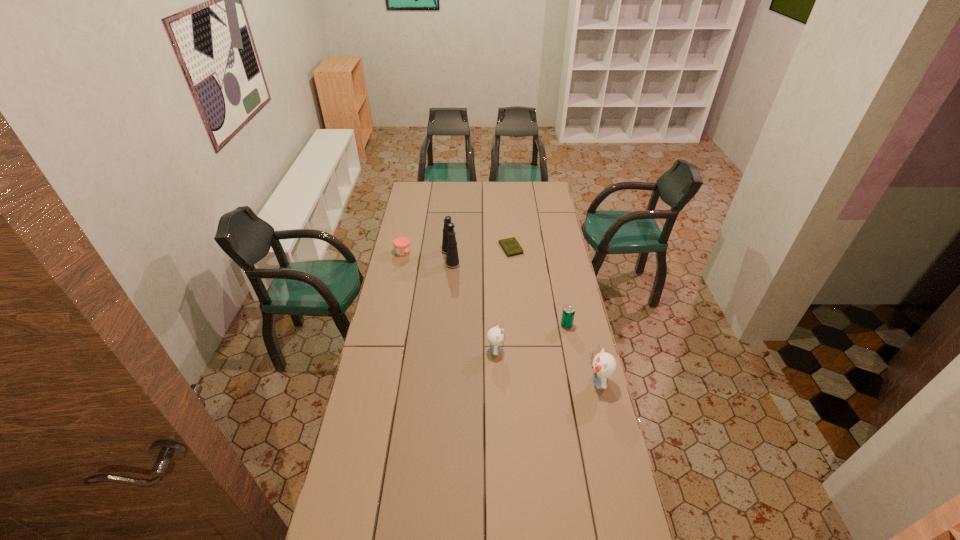
Locate an element on the screen. This screenshot has height=540, width=960. the left kitten is located at coordinates (495, 336).

The image size is (960, 540). Identify the location of the shorter kitten. (495, 336).

This screenshot has width=960, height=540. I want to click on the fifth shortest object, so click(604, 365).

You are a GUI agent. You are given a task and a screenshot of the screen. Output one action in this format:
    pyautogui.click(x=<x>, y=<y>)
    Task: Click on the right kitten
    The height and width of the screenshot is (540, 960).
    Given the screenshot: What is the action you would take?
    pyautogui.click(x=604, y=365)

What are the coordinates of `the fifth object from right to left` in the screenshot? It's located at (449, 245).

The image size is (960, 540). Find the location of `binoculars`. binoculars is located at coordinates (449, 245).

The height and width of the screenshot is (540, 960). I want to click on the leftmost object, so click(401, 244).

Identify the location of jam. click(401, 244).

You are a GUI agent. You are given a task and a screenshot of the screen. Output one action in this format:
    pyautogui.click(x=<x>, y=<y>)
    Task: Click on the shortest object
    
    Given the screenshot: What is the action you would take?
    pyautogui.click(x=511, y=247)

The height and width of the screenshot is (540, 960). Identify the location of the second object from right to left. (568, 313).